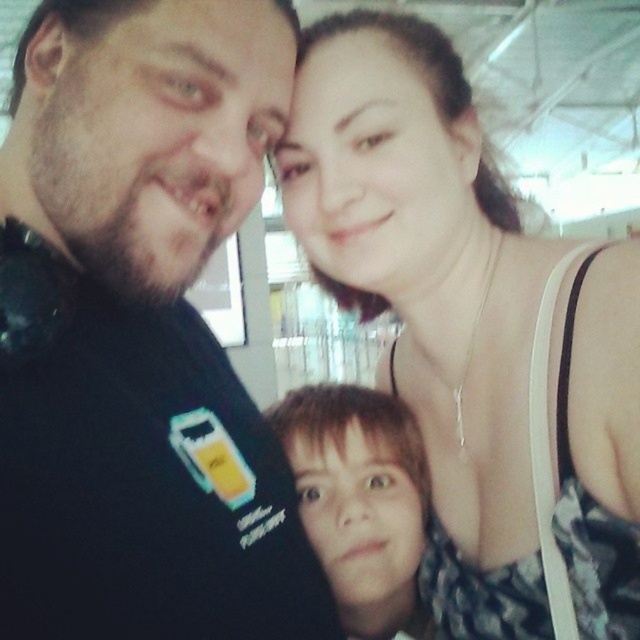
Question: Is matte black tank top at upper right to the right of smooth skin face at center from the viewer's perspective?

Choices:
 (A) yes
 (B) no

Answer: (A)

Question: Estimate the real-world distances between objects in this image. Which object is closer to the black matte shirt at upper left?

Choices:
 (A) smooth skin face at center
 (B) matte black tank top at upper right

Answer: (B)

Question: Which point appears farthest from the camera in this image?

Choices:
 (A) (205, 60)
 (B) (353, 52)
 (C) (369, 616)

Answer: (C)

Question: Which point is closer to the camera?

Choices:
 (A) matte black tank top at upper right
 (B) black matte shirt at upper left

Answer: (B)

Question: Does black matte shirt at upper left have a larger size compared to smooth skin face at center?

Choices:
 (A) yes
 (B) no

Answer: (A)

Question: Observing the image, what is the correct spatial positioning of black matte shirt at upper left in reference to smooth skin face at center?

Choices:
 (A) above
 (B) below

Answer: (A)